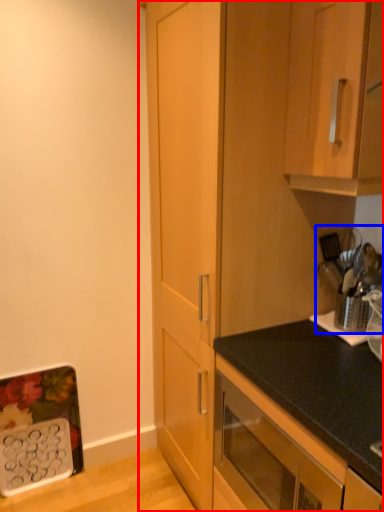
Question: Which point is closer to the camera, cabinetry (highlighted by a red box) or appliance (highlighted by a blue box)?

Choices:
 (A) cabinetry
 (B) appliance

Answer: (A)